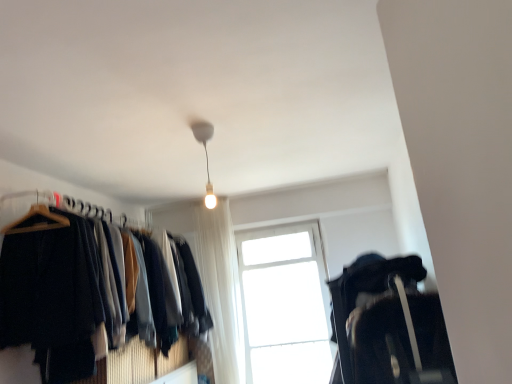
Question: Considering the relative sizes of transparent glass window at center and matte black hangers at left, the 2th closet from the right, in the image provided, is transparent glass window at center bigger than matte black hangers at left, the 2th closet from the right,?

Choices:
 (A) no
 (B) yes

Answer: (A)

Question: From a real-world perspective, is transparent glass window at center physically below matte black hangers at left, the 1th closet when ordered from left to right?

Choices:
 (A) yes
 (B) no

Answer: (A)

Question: Considering the relative sizes of transparent glass window at center and matte black hangers at left, the 1th closet when ordered from left to right, in the image provided, is transparent glass window at center shorter than matte black hangers at left, the 1th closet when ordered from left to right,?

Choices:
 (A) yes
 (B) no

Answer: (B)

Question: Is transparent glass window at center smaller than matte black hangers at left, the 1th closet when ordered from left to right?

Choices:
 (A) no
 (B) yes

Answer: (B)

Question: Considering the relative sizes of transparent glass window at center and matte black hangers at left, the 2th closet from the right, in the image provided, is transparent glass window at center taller than matte black hangers at left, the 2th closet from the right,?

Choices:
 (A) no
 (B) yes

Answer: (B)

Question: Are transparent glass window at center and matte black hangers at left, the 1th closet when ordered from left to right, beside each other?

Choices:
 (A) yes
 (B) no

Answer: (B)

Question: Are matte white bulb at upper center and matte black hangers at left, the 1th closet when ordered from left to right, located far from each other?

Choices:
 (A) yes
 (B) no

Answer: (B)

Question: Is matte white bulb at upper center next to matte black hangers at left, the 2th closet from the right?

Choices:
 (A) yes
 (B) no

Answer: (B)

Question: Could you tell me if matte white bulb at upper center is facing matte black hangers at left, the 1th closet when ordered from left to right?

Choices:
 (A) no
 (B) yes

Answer: (A)

Question: From the image's perspective, is matte white bulb at upper center located beneath matte black hangers at left, the 2th closet from the right?

Choices:
 (A) yes
 (B) no

Answer: (B)

Question: From a real-world perspective, is matte white bulb at upper center on matte black hangers at left, the 1th closet when ordered from left to right?

Choices:
 (A) no
 (B) yes

Answer: (B)

Question: Considering the relative sizes of matte white bulb at upper center and matte black hangers at left, the 2th closet from the right, in the image provided, is matte white bulb at upper center wider than matte black hangers at left, the 2th closet from the right,?

Choices:
 (A) no
 (B) yes

Answer: (A)

Question: Is black fabric suitcase at lower right, placed as the 1th closet when sorted from right to left, next to transparent glass window at center and touching it?

Choices:
 (A) yes
 (B) no

Answer: (B)